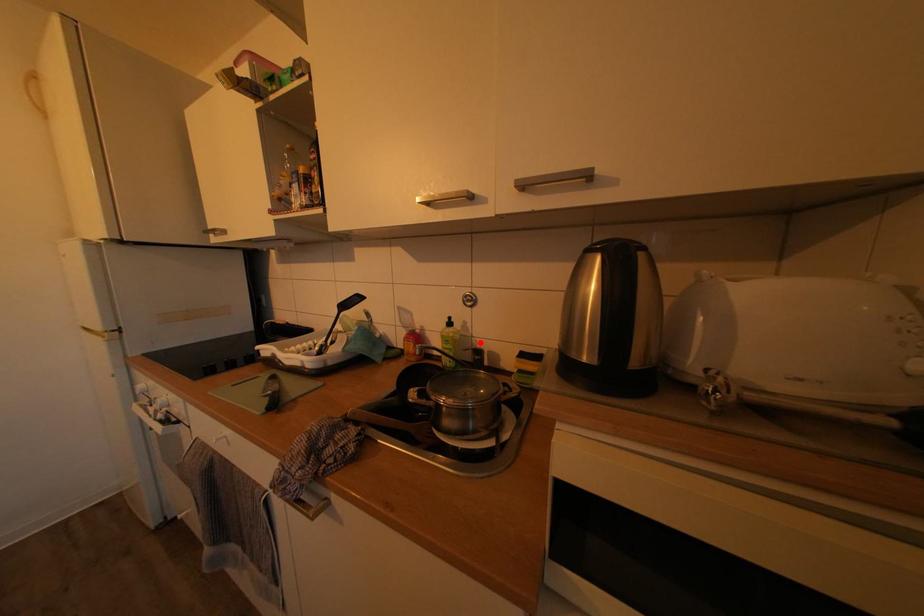
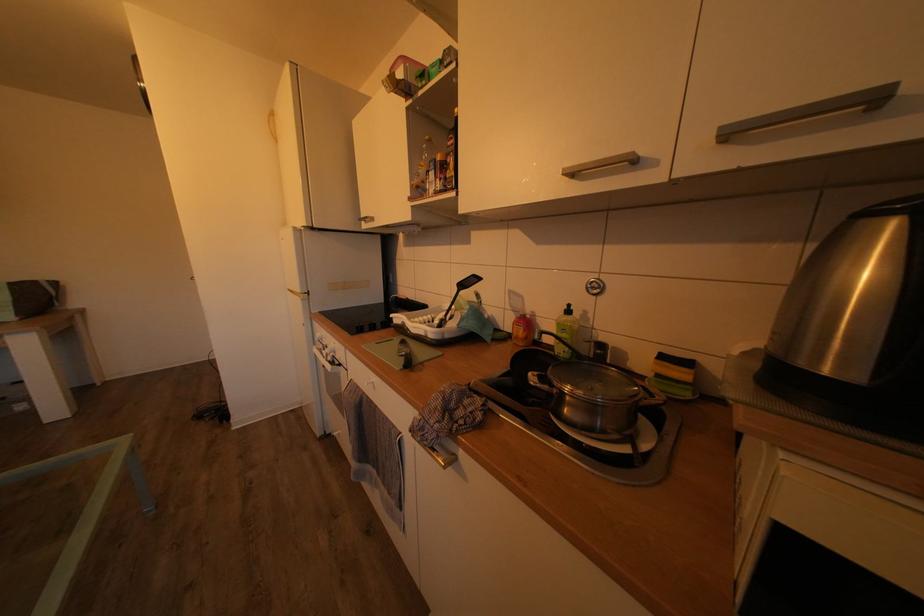
The point at the highlighted location is marked in the first image. Where is the corresponding point in the second image?

(601, 334)